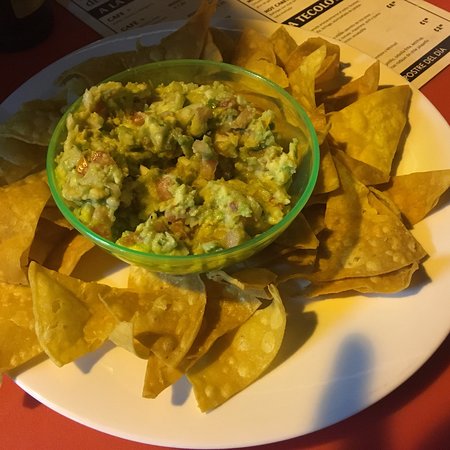
You are a GUI agent. You are given a task and a screenshot of the screen. Output one action in this format:
    pyautogui.click(x=<x>, y=<y>)
    Task: Click on the corner in photo with shadows
    
    Given the screenshot: What is the action you would take?
    pyautogui.click(x=35, y=42)